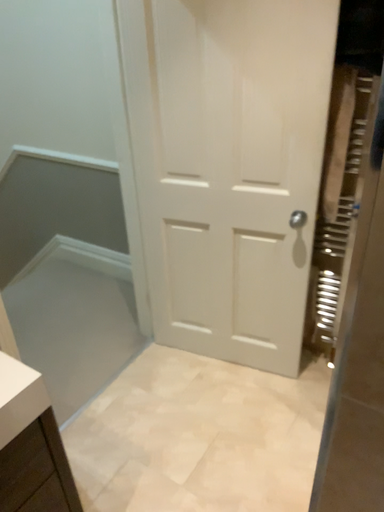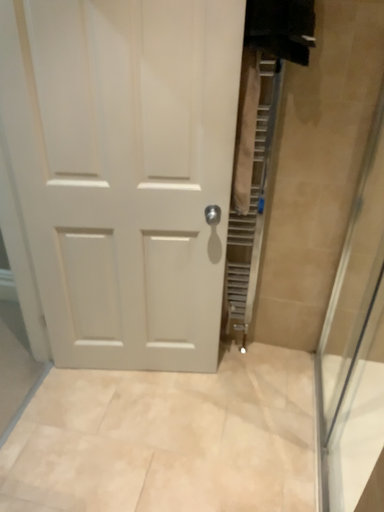
Question: Which way did the camera rotate in the video?

Choices:
 (A) rotated left
 (B) rotated right

Answer: (B)